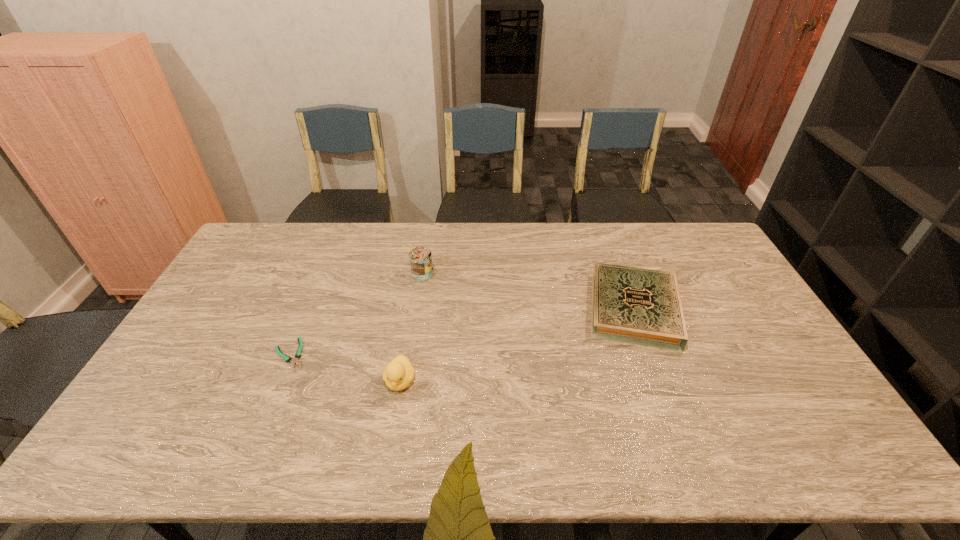
The height and width of the screenshot is (540, 960). Identify the location of free region at the far edge of the desktop. (501, 240).

Locate an element on the screen. The image size is (960, 540). free region at the left edge is located at coordinates (220, 366).

Locate an element on the screen. free space at the right edge of the desktop is located at coordinates (709, 310).

Image resolution: width=960 pixels, height=540 pixels. In the image, there is a desktop. Identify the location of vacant space at the far left corner. (288, 225).

In the image, there is a desktop. At what (x,y) coordinates should I click in order to perform the action: click on vacant space at the near left corner. Please return your answer as a coordinate pair (x, y). The height and width of the screenshot is (540, 960). Looking at the image, I should click on (162, 456).

You are a GUI agent. You are given a task and a screenshot of the screen. Output one action in this format:
    pyautogui.click(x=<x>, y=<y>)
    Task: Click on the vacant region at the far right corner
    The width and height of the screenshot is (960, 540).
    Given the screenshot: What is the action you would take?
    pyautogui.click(x=684, y=242)

You are a GUI agent. You are given a task and a screenshot of the screen. Output one action in this format:
    pyautogui.click(x=<x>, y=<y>)
    Task: Click on the unoccupied area between the second shortest object and the leftmost object
    
    Given the screenshot: What is the action you would take?
    pyautogui.click(x=462, y=332)

This screenshot has width=960, height=540. Identify the location of free space between the shortest object and the duck. (345, 368).

Where is `free point between the second tallest object and the hardback book`? free point between the second tallest object and the hardback book is located at coordinates (516, 345).

Identify the location of free space between the rightmost object and the leftmost object. (462, 332).